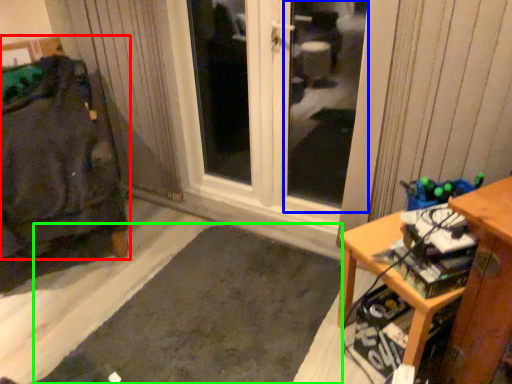
Question: Which object is positioned closest to furniture (highlighted by a red box)? Select from window screen (highlighted by a blue box) and doormat (highlighted by a green box).

Choices:
 (A) window screen
 (B) doormat

Answer: (B)